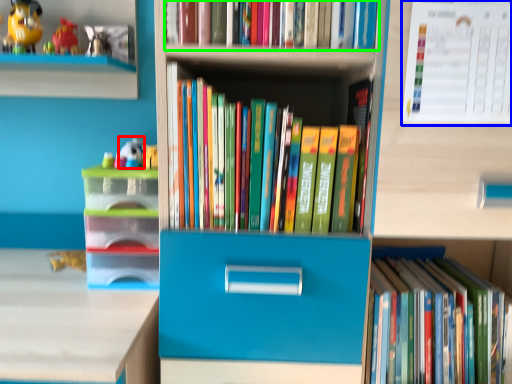
Question: Based on their relative distances, which object is farther from toy (highlighted by a red box)? Choose from paperback book (highlighted by a blue box) and book (highlighted by a green box).

Choices:
 (A) paperback book
 (B) book

Answer: (A)